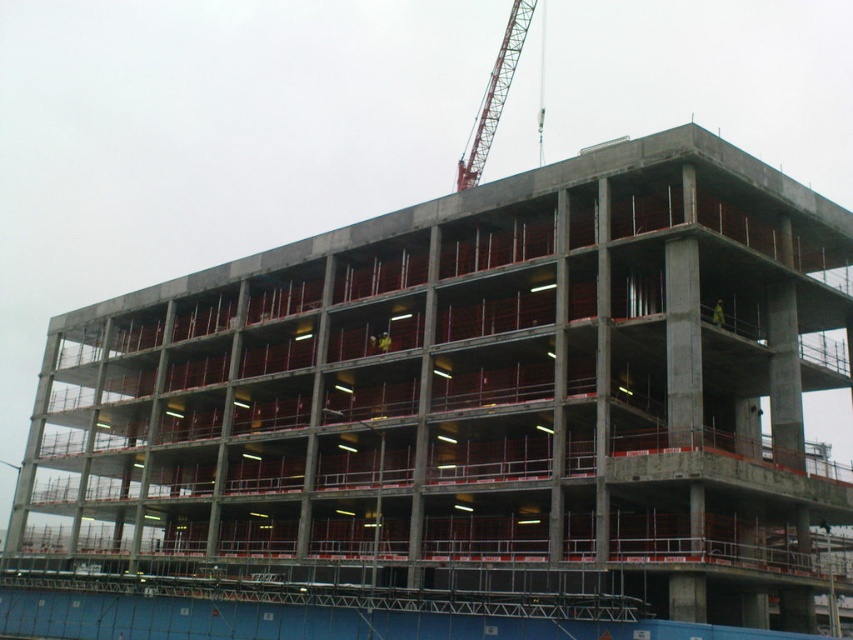
Looking at this image, is metallic red crane at upper center thinner than yellow reflective vest at upper center?

Incorrect, metallic red crane at upper center's width is not less than yellow reflective vest at upper center's.

Does metallic red crane at upper center have a lesser height compared to yellow reflective vest at upper center?

Incorrect, metallic red crane at upper center's height does not fall short of yellow reflective vest at upper center's.

Is point (529, 19) positioned after point (720, 323)?

Yes, point (529, 19) is farther from viewer.

Find the location of a particular element. metallic red crane at upper center is located at coordinates (494, 96).